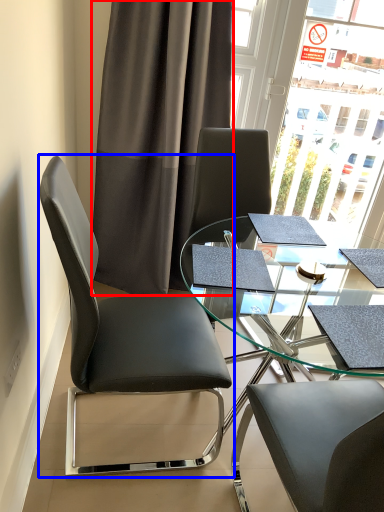
Question: Which of the following is the closest to the observer, curtain (highlighted by a red box) or chair (highlighted by a blue box)?

Choices:
 (A) curtain
 (B) chair

Answer: (B)